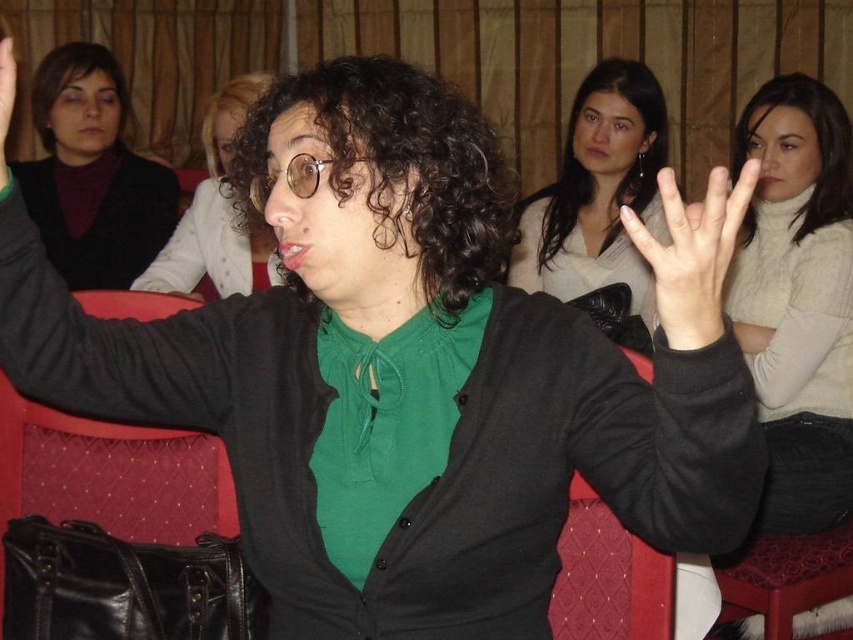
Question: Does matte black sweater at upper left appear over matte black hand at upper center?

Choices:
 (A) no
 (B) yes

Answer: (B)

Question: Which of the following is the closest to the observer?

Choices:
 (A) (668, 252)
 (B) (109, 150)
 (C) (839, 490)
 (D) (134, 284)

Answer: (A)

Question: Which of the following is the closest to the observer?

Choices:
 (A) matte black sweater at upper left
 (B) knitted white sweater at upper right
 (C) green matte shirt at center
 (D) smooth skin hand at center

Answer: (D)

Question: Which object is farther from the camera taking this photo?

Choices:
 (A) matte white blouse at upper center
 (B) knitted white sweater at upper right
 (C) green matte shirt at center

Answer: (A)

Question: From the image, what is the correct spatial relationship of knitted white sweater at upper right in relation to matte white blouse at upper center?

Choices:
 (A) left
 (B) right

Answer: (B)

Question: Is matte white blouse at upper center positioned behind matte black hand at upper center?

Choices:
 (A) no
 (B) yes

Answer: (B)